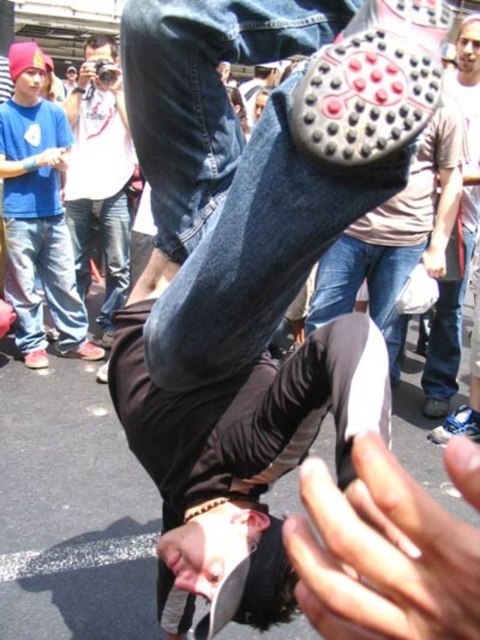
Does rubber textured sole at center have a greater height compared to matte blue jeans at upper left?

No, rubber textured sole at center is not taller than matte blue jeans at upper left.

Which is in front, point (411, 97) or point (28, 186)?

Point (411, 97) is more forward.

Where is `rubber textured sole at center`? The width and height of the screenshot is (480, 640). rubber textured sole at center is located at coordinates (372, 83).

Which of these two, white cotton t-shirt at upper left or matte gray shoe at upper center, stands taller?

With more height is matte gray shoe at upper center.

Can you confirm if white cotton t-shirt at upper left is positioned to the left of matte gray shoe at upper center?

Indeed, white cotton t-shirt at upper left is positioned on the left side of matte gray shoe at upper center.

Between point (108, 317) and point (435, 404), which one is positioned behind?

Point (108, 317)

Locate an element on the screen. The height and width of the screenshot is (640, 480). white cotton t-shirt at upper left is located at coordinates (99, 177).

Between matte blue jeans at upper left and matte gray shoe at upper center, which one has less height?

With less height is matte blue jeans at upper left.

Does point (46, 276) come behind point (475, 28)?

Yes, it is behind point (475, 28).

The width and height of the screenshot is (480, 640). I want to click on matte blue jeans at upper left, so click(x=37, y=216).